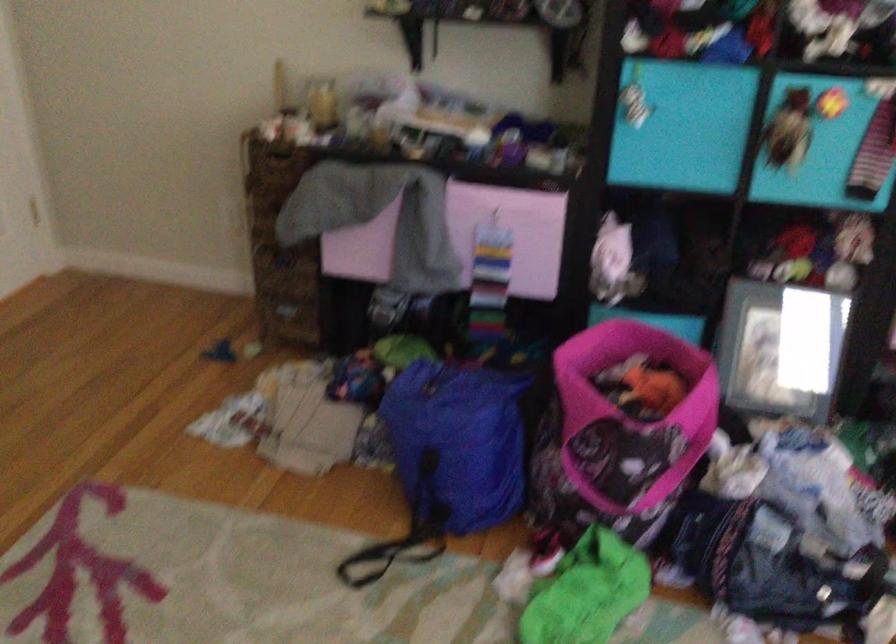
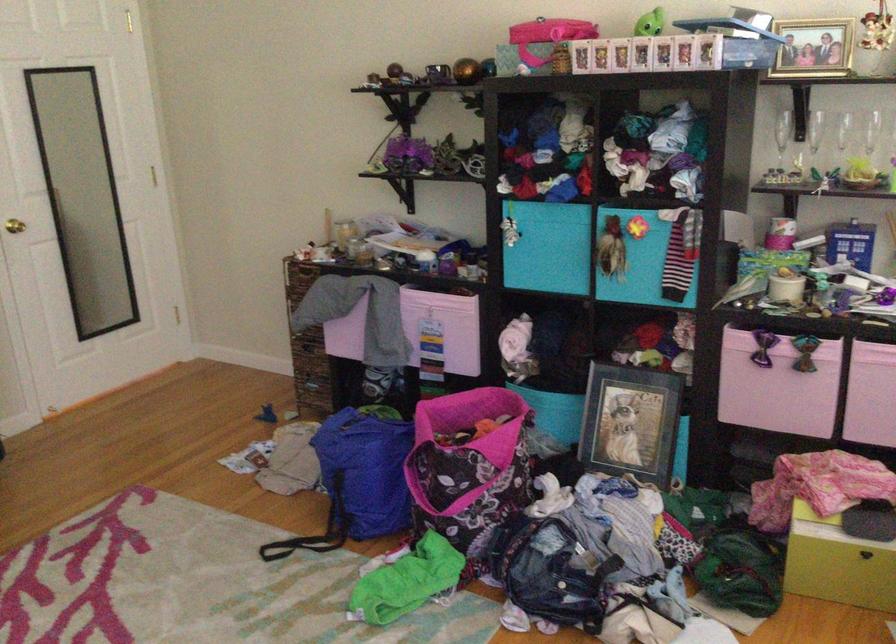
The point at (376, 569) is marked in the first image. Where is the corresponding point in the second image?

(288, 547)